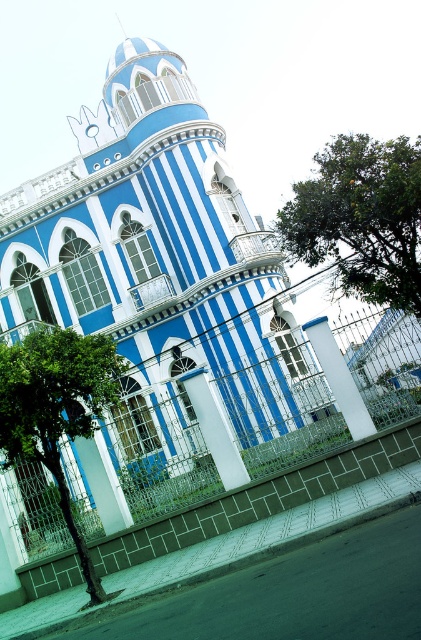
You are standing in front of the blue glossy building at center. A friend asks you to describe its location relative to the decorative metal fence and white pillars mentioned in the scene. How would you respond?

The blue glossy building at center is located at point coordinates of (160, 292), which places it centrally within the scene, surrounded by the decorative metal fence and supported by white pillars as described.

You are a photographer standing in front of the blue glossy building at center. You want to take a picture of it but need to ensure you are far enough away to capture the entire structure in one shot. The recommended minimum distance for capturing the entire building in a single frame is 150 feet. Based on the information provided, can you determine if your current position allows you to capture the entire building in one shot?

The blue glossy building at center is 162.37 feet from camera, which exceeds the recommended minimum distance of 150 feet. Therefore, you are far enough to capture the entire building in one shot.